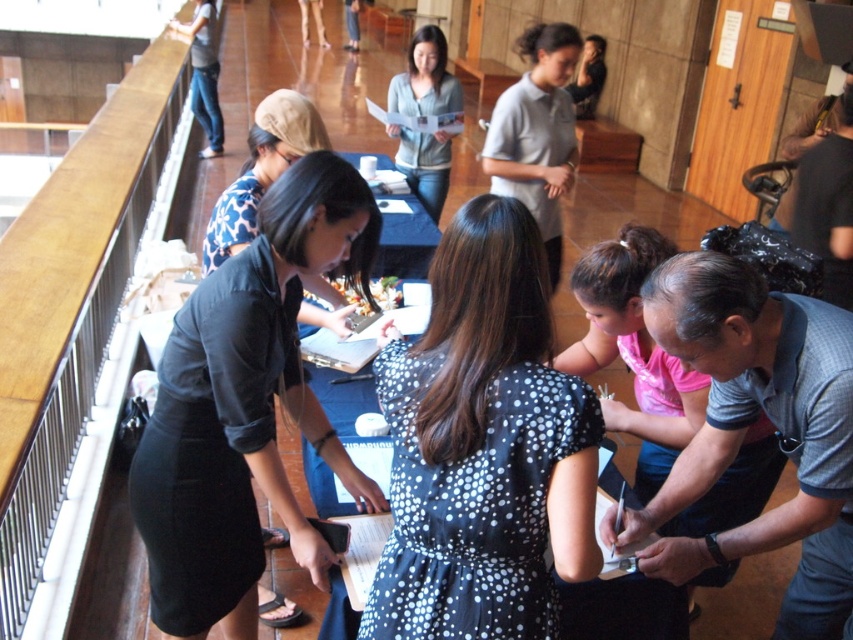
Is point (473, 461) positioned in front of point (294, 420)?

Yes, it is.

Is point (419, 364) more distant than point (228, 307)?

No, (419, 364) is closer to viewer.

Is point (587, 401) positioned in front of point (148, 426)?

Yes, point (587, 401) is in front of point (148, 426).

Find the location of a particular element. The width and height of the screenshot is (853, 640). black dotted dress at center is located at coordinates (483, 445).

Between matte black dress at center and light blue knit sweater at center, which one appears on the left side from the viewer's perspective?

From the viewer's perspective, matte black dress at center appears more on the left side.

Between point (230, 580) and point (396, 108), which one is positioned behind?

The point (396, 108) is more distant.

Where is `matte black dress at center`? The width and height of the screenshot is (853, 640). matte black dress at center is located at coordinates (245, 406).

What do you see at coordinates (483, 445) in the screenshot? I see `black dotted dress at center` at bounding box center [483, 445].

Which is above, black dotted dress at center or light blue knit sweater at center?

Positioned higher is light blue knit sweater at center.

What do you see at coordinates (483, 445) in the screenshot? Image resolution: width=853 pixels, height=640 pixels. I see `black dotted dress at center` at bounding box center [483, 445].

Locate an element on the screen. Image resolution: width=853 pixels, height=640 pixels. black dotted dress at center is located at coordinates (483, 445).